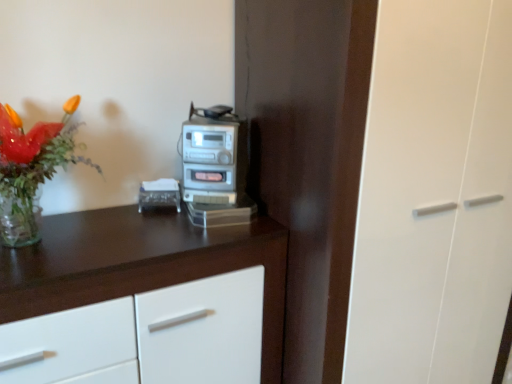
Image resolution: width=512 pixels, height=384 pixels. Find the location of `vacant position to the left of clear plastic tissue box at center`. vacant position to the left of clear plastic tissue box at center is located at coordinates (106, 216).